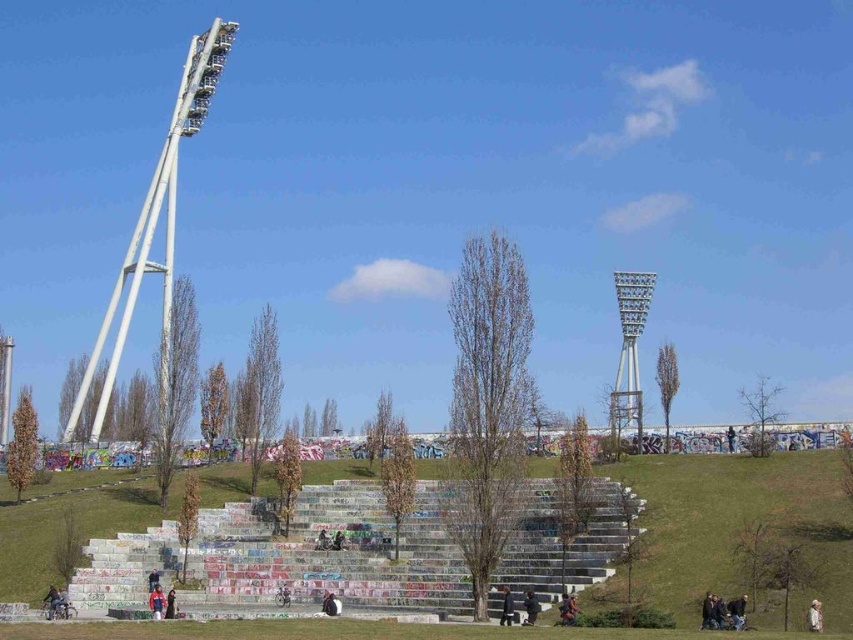
Question: Does red fabric jacket at lower left appear over white cotton shirt at lower right?

Choices:
 (A) yes
 (B) no

Answer: (B)

Question: Is concrete steps at center to the left of concrete stairs at center from the viewer's perspective?

Choices:
 (A) yes
 (B) no

Answer: (B)

Question: Is concrete steps at center closer to camera compared to concrete stairs at center?

Choices:
 (A) yes
 (B) no

Answer: (A)

Question: Which point appears closest to the camera in this image?

Choices:
 (A) (619, 490)
 (B) (634, 400)
 (C) (297, 600)

Answer: (C)

Question: Among these objects, which one is farthest from the camera?

Choices:
 (A) white metallic tower at left
 (B) dark gray jacket at center

Answer: (A)

Question: Which point appears farthest from the camera in this image?

Choices:
 (A) (305, 582)
 (B) (526, 609)
 (C) (645, 284)

Answer: (C)